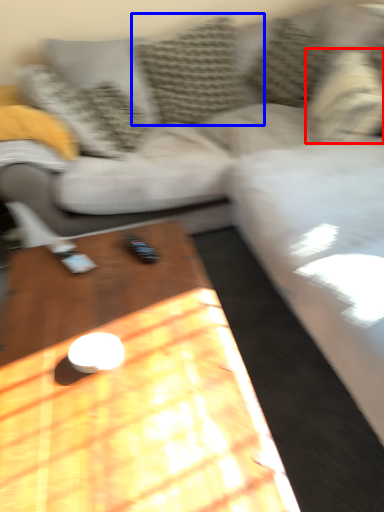
Question: Which point is further to the camera, pillow (highlighted by a red box) or pillow (highlighted by a blue box)?

Choices:
 (A) pillow
 (B) pillow

Answer: (B)